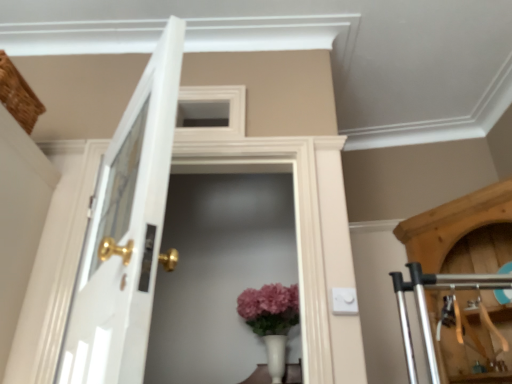
Question: Can you confirm if white glossy door at left is positioned to the right of white glass screen door at center?

Choices:
 (A) yes
 (B) no

Answer: (B)

Question: Is white glossy door at left behind white glass screen door at center?

Choices:
 (A) yes
 (B) no

Answer: (B)

Question: Does white glossy door at left have a lesser width compared to white glass screen door at center?

Choices:
 (A) yes
 (B) no

Answer: (B)

Question: Considering the relative sizes of white glossy door at left and white glass screen door at center in the image provided, is white glossy door at left wider than white glass screen door at center?

Choices:
 (A) yes
 (B) no

Answer: (A)

Question: Is white glossy door at left closer to the viewer compared to white glass screen door at center?

Choices:
 (A) no
 (B) yes

Answer: (B)

Question: From the image's perspective, is matte white vase at center above or below white glass screen door at center?

Choices:
 (A) above
 (B) below

Answer: (B)

Question: Is matte white vase at center in front of or behind white glass screen door at center in the image?

Choices:
 (A) front
 (B) behind

Answer: (B)

Question: Is matte white vase at center wider or thinner than white glass screen door at center?

Choices:
 (A) thin
 (B) wide

Answer: (B)

Question: From a real-world perspective, is matte white vase at center physically located above or below white glass screen door at center?

Choices:
 (A) below
 (B) above

Answer: (A)

Question: From the image's perspective, is white glass screen door at center located above or below white glossy door at left?

Choices:
 (A) below
 (B) above

Answer: (A)

Question: Considering the positions of point (239, 246) and point (78, 268), is point (239, 246) closer or farther from the camera than point (78, 268)?

Choices:
 (A) farther
 (B) closer

Answer: (A)

Question: Looking at the image, does white glass screen door at center seem bigger or smaller compared to white glossy door at left?

Choices:
 (A) big
 (B) small

Answer: (B)

Question: Looking at their shapes, would you say white glass screen door at center is wider or thinner than white glossy door at left?

Choices:
 (A) thin
 (B) wide

Answer: (A)

Question: In terms of size, does white glossy door at left appear bigger or smaller than matte white vase at center?

Choices:
 (A) big
 (B) small

Answer: (A)

Question: Visually, is white glossy door at left positioned to the left or to the right of matte white vase at center?

Choices:
 (A) right
 (B) left

Answer: (B)